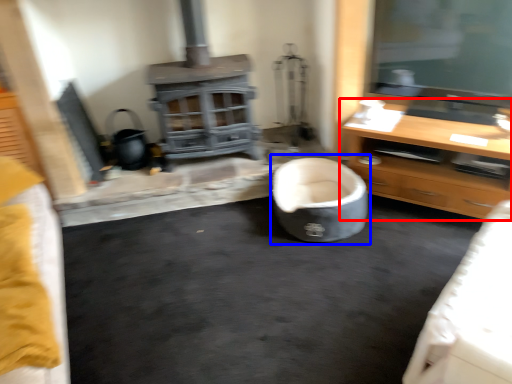
Question: Which of the following is the closest to the observer, cabinetry (highlighted by a red box) or bean bag chair (highlighted by a blue box)?

Choices:
 (A) cabinetry
 (B) bean bag chair

Answer: (A)